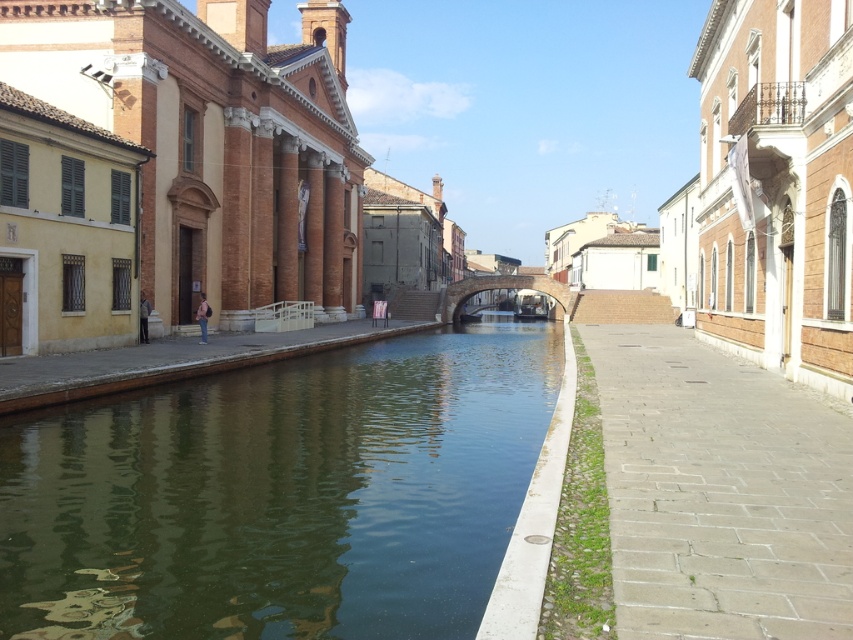
Is greenish water at center in front of brick stone bridge at center?

Yes.

Can you confirm if greenish water at center is smaller than brick stone bridge at center?

Yes, greenish water at center is smaller than brick stone bridge at center.

Between point (329, 522) and point (445, 305), which one is positioned in front?

Point (329, 522) is more forward.

Identify the location of greenish water at center. (281, 493).

Between greenish water at center and green concrete sidewalk at lower right, which one has more height?

→ greenish water at center is taller.

Which is above, greenish water at center or green concrete sidewalk at lower right?

green concrete sidewalk at lower right

The width and height of the screenshot is (853, 640). What do you see at coordinates (281, 493) in the screenshot? I see `greenish water at center` at bounding box center [281, 493].

Where is `greenish water at center`? This screenshot has height=640, width=853. greenish water at center is located at coordinates (281, 493).

Describe the element at coordinates (720, 492) in the screenshot. The image size is (853, 640). I see `green concrete sidewalk at lower right` at that location.

Who is positioned more to the right, green concrete sidewalk at lower right or brick stone bridge at center?

Positioned to the right is brick stone bridge at center.

Is point (828, 452) less distant than point (450, 298)?

That is True.

The height and width of the screenshot is (640, 853). What are the coordinates of `green concrete sidewalk at lower right` in the screenshot? It's located at (720, 492).